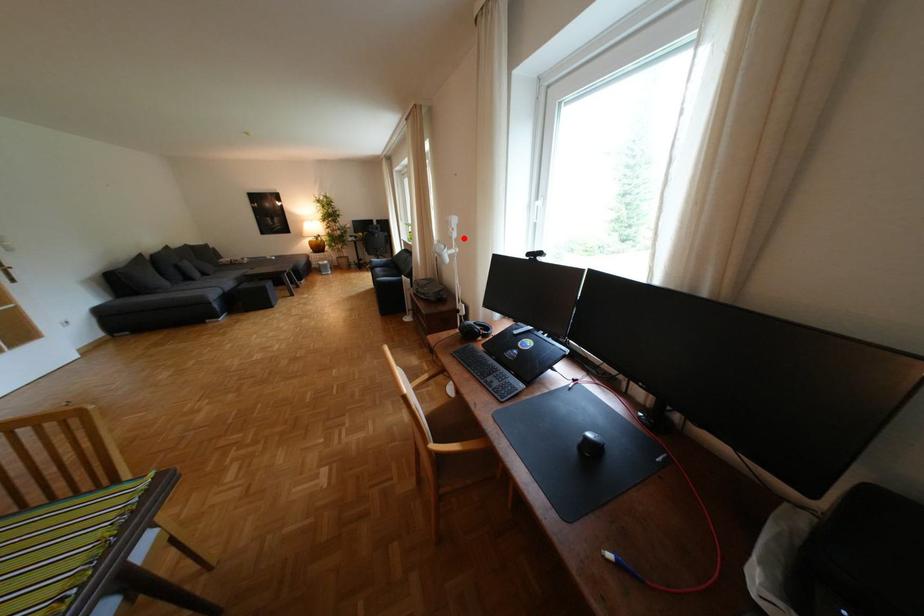
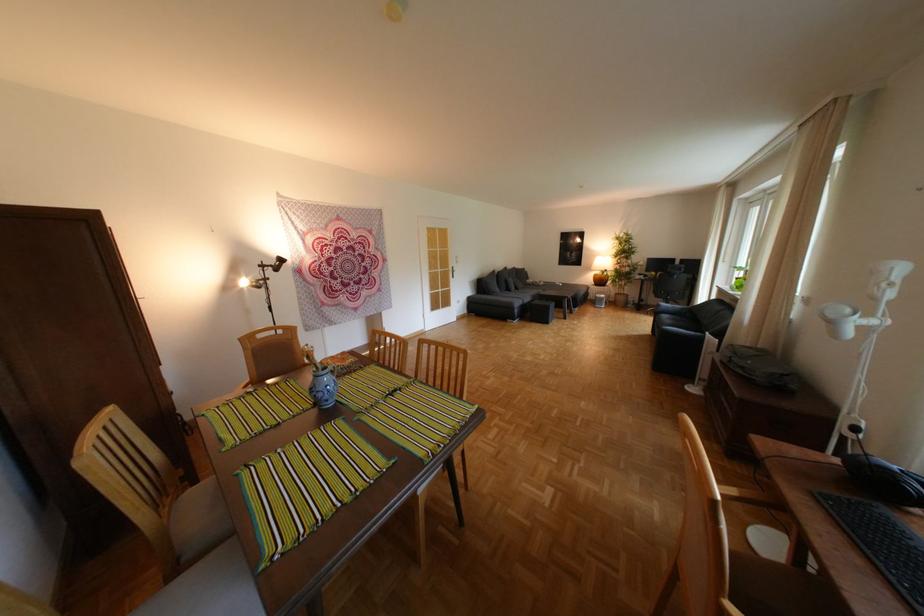
Find the pixel in the second image that matches the highlighted location in the first image.

(888, 299)